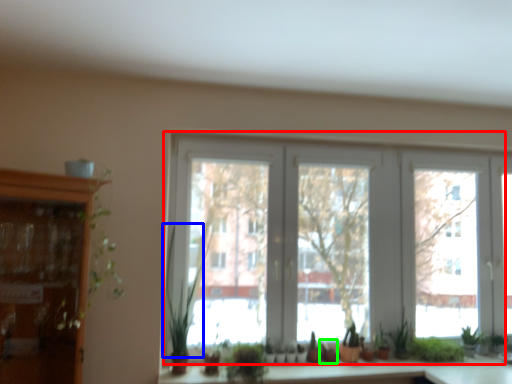
Question: Which object is positioned farthest from window (highlighted by a red box)? Select from plant (highlighted by a blue box) and plant (highlighted by a green box).

Choices:
 (A) plant
 (B) plant

Answer: (B)